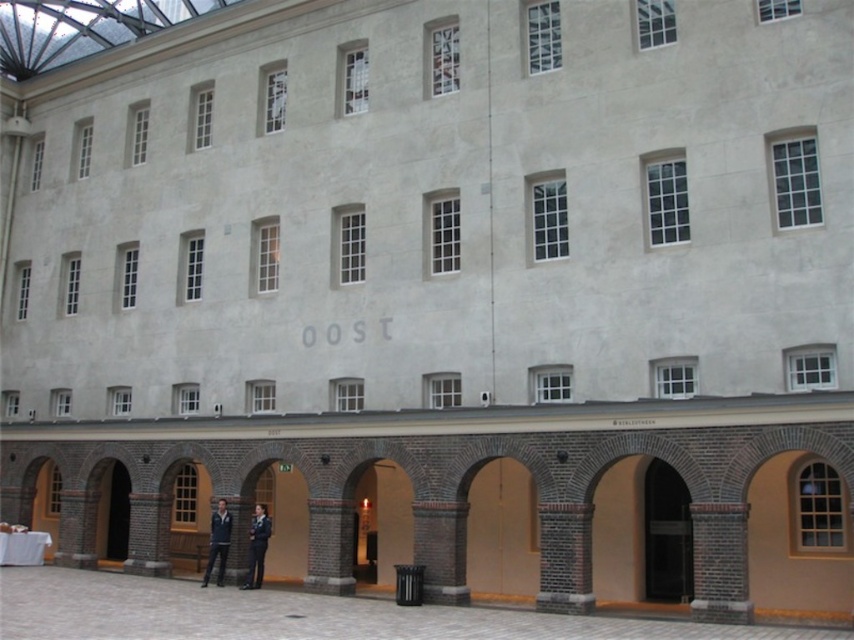
Question: Which object appears closest to the camera in this image?

Choices:
 (A) dark blue uniform at center
 (B) dark blue jacket at center

Answer: (A)

Question: Does dark blue uniform at center appear on the left side of dark blue jacket at center?

Choices:
 (A) yes
 (B) no

Answer: (B)

Question: Does dark blue uniform at center appear on the right side of dark blue jacket at center?

Choices:
 (A) no
 (B) yes

Answer: (B)

Question: Can you confirm if dark blue uniform at center is smaller than dark blue jacket at center?

Choices:
 (A) no
 (B) yes

Answer: (B)